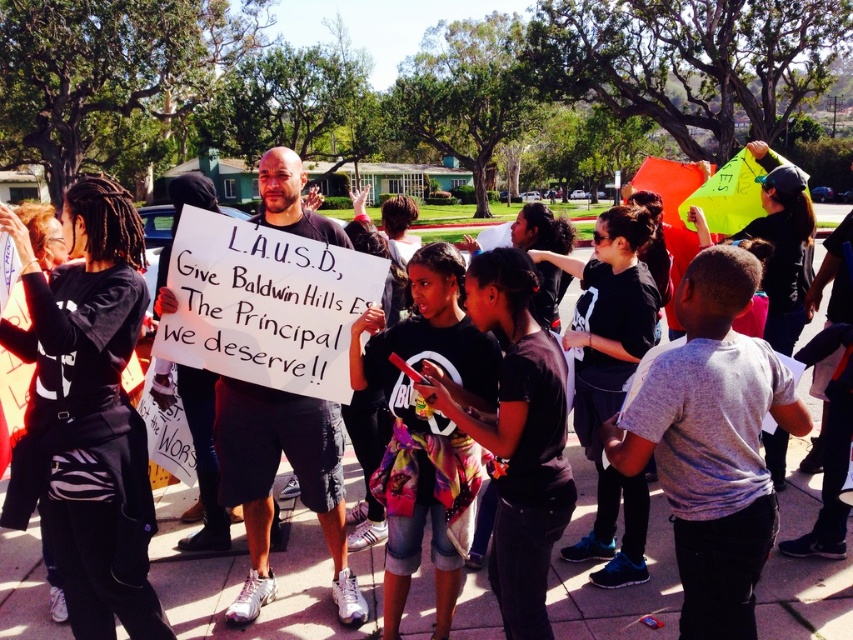
You are a photographer at the protest scene. You want to take a photo that includes both the multicolored denim shorts at center and the white paper sign at center. Which object should you zoom in on to ensure both are clearly visible in the frame?

To ensure both the multicolored denim shorts at center and the white paper sign at center are clearly visible, you should zoom in on the multicolored denim shorts at center since it is thinner than the white paper sign at center, allowing both to fit within the frame more easily.

You are a photographer at the protest scene. You want to take a photo that includes both the multicolored denim shorts at center and the white paper sign at center. Which object should you focus on first to ensure both are in frame?

You should focus on the white paper sign at center first because it occupies more space than the multicolored denim shorts at center, ensuring it fits within the frame while also capturing the smaller object.

What is the location of the multicolored denim shorts at center in the image?

The multicolored denim shorts at center is located at point (425, 424).